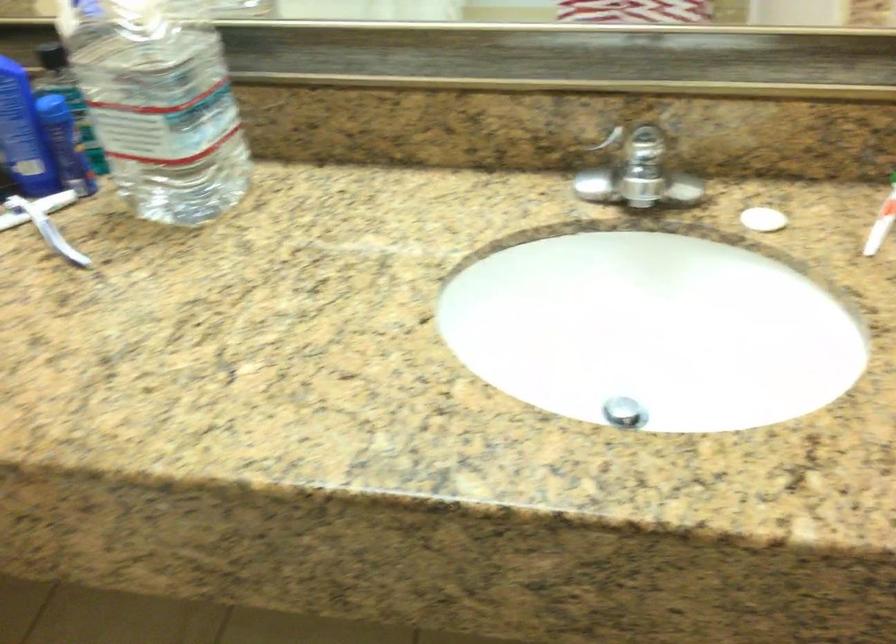
This screenshot has height=644, width=896. In order to click on sink drain plug in this screenshot , I will do pyautogui.click(x=624, y=412).